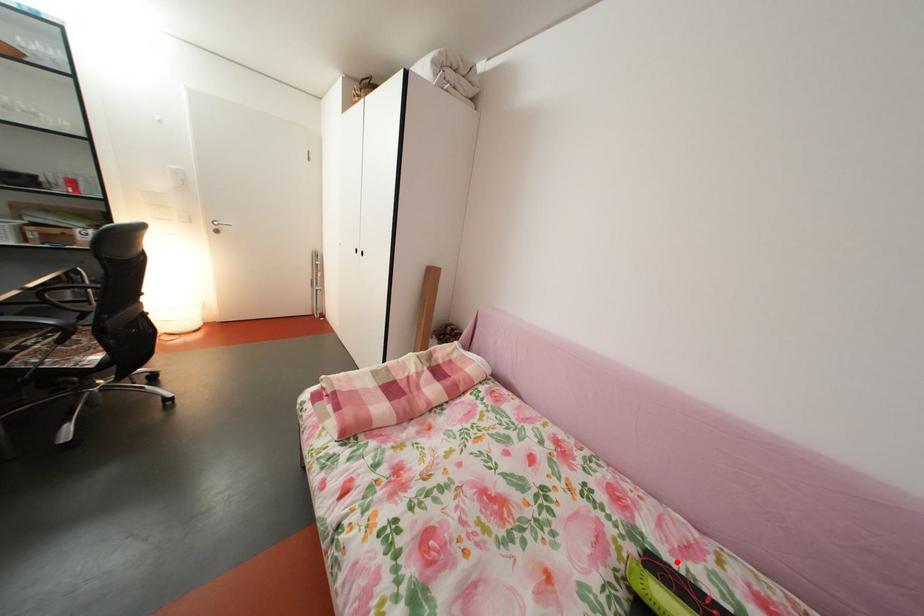
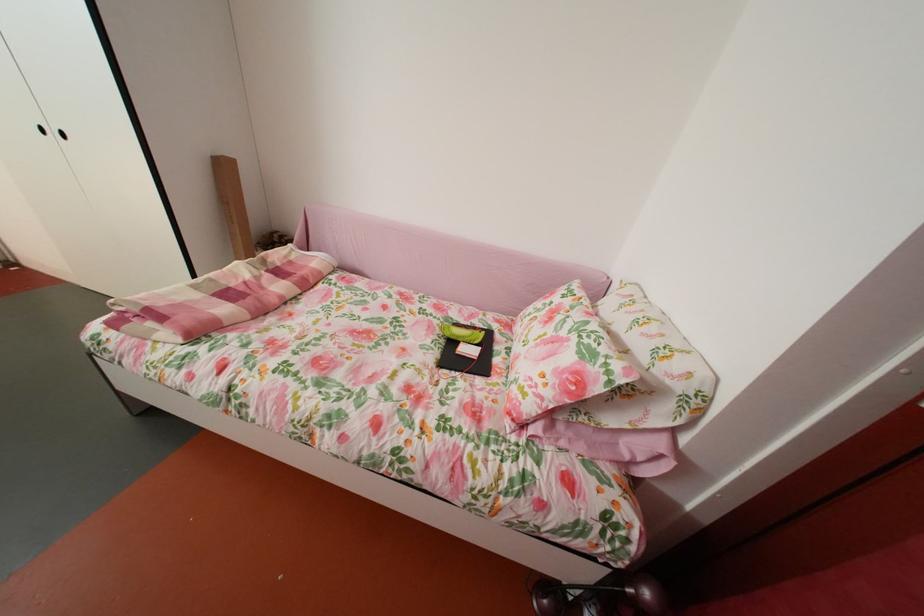
Locate, in the second image, the point that corresponds to the highlighted location in the first image.

(473, 328)